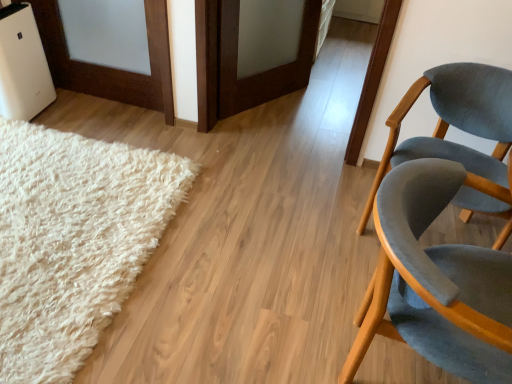
Question: Is white fluffy rug at lower left a part of matte gray chair at right, placed as the 2th chair when sorted from front to back?

Choices:
 (A) no
 (B) yes

Answer: (A)

Question: Does matte gray chair at right, placed as the 2th chair when sorted from front to back, come in front of white fluffy rug at lower left?

Choices:
 (A) no
 (B) yes

Answer: (A)

Question: Is matte gray chair at right, the first chair when ordered from back to front, with white fluffy rug at lower left?

Choices:
 (A) yes
 (B) no

Answer: (B)

Question: Is the depth of matte gray chair at right, placed as the 2th chair when sorted from front to back, greater than that of white fluffy rug at lower left?

Choices:
 (A) yes
 (B) no

Answer: (A)

Question: From a real-world perspective, does matte gray chair at right, the first chair when ordered from back to front, sit lower than white fluffy rug at lower left?

Choices:
 (A) no
 (B) yes

Answer: (A)

Question: Considering the positions of matte gray chair at right, the first chair when ordered from back to front, and white fluffy rug at lower left in the image, is matte gray chair at right, the first chair when ordered from back to front, wider or thinner than white fluffy rug at lower left?

Choices:
 (A) wide
 (B) thin

Answer: (B)

Question: Considering the positions of matte gray chair at right, the first chair when ordered from back to front, and white fluffy rug at lower left in the image, is matte gray chair at right, the first chair when ordered from back to front, taller or shorter than white fluffy rug at lower left?

Choices:
 (A) tall
 (B) short

Answer: (A)

Question: Looking at the image, does matte gray chair at right, the first chair when ordered from back to front, seem bigger or smaller compared to white fluffy rug at lower left?

Choices:
 (A) small
 (B) big

Answer: (A)

Question: Considering their positions, is matte gray chair at right, placed as the 2th chair when sorted from front to back, located in front of or behind white fluffy rug at lower left?

Choices:
 (A) front
 (B) behind

Answer: (B)

Question: Based on their sizes in the image, would you say white fluffy rug at lower left is bigger or smaller than matte gray chair at right, placed as the 2th chair when sorted from front to back?

Choices:
 (A) big
 (B) small

Answer: (A)

Question: Would you say white fluffy rug at lower left is inside or outside matte gray chair at right, the first chair when ordered from back to front?

Choices:
 (A) outside
 (B) inside

Answer: (A)

Question: Is white fluffy rug at lower left wider or thinner than matte gray chair at right, placed as the 2th chair when sorted from front to back?

Choices:
 (A) wide
 (B) thin

Answer: (A)

Question: Considering the relative positions of white fluffy rug at lower left and matte gray chair at right, placed as the 2th chair when sorted from front to back, in the image provided, is white fluffy rug at lower left to the left or to the right of matte gray chair at right, placed as the 2th chair when sorted from front to back,?

Choices:
 (A) right
 (B) left

Answer: (B)

Question: From a real-world perspective, relative to velvet grey chair at right, which is counted as the 2th chair, starting from the back, is matte gray chair at right, the first chair when ordered from back to front, vertically above or below?

Choices:
 (A) above
 (B) below

Answer: (B)

Question: From their relative heights in the image, would you say matte gray chair at right, placed as the 2th chair when sorted from front to back, is taller or shorter than velvet grey chair at right, which is counted as the 2th chair, starting from the back?

Choices:
 (A) short
 (B) tall

Answer: (B)